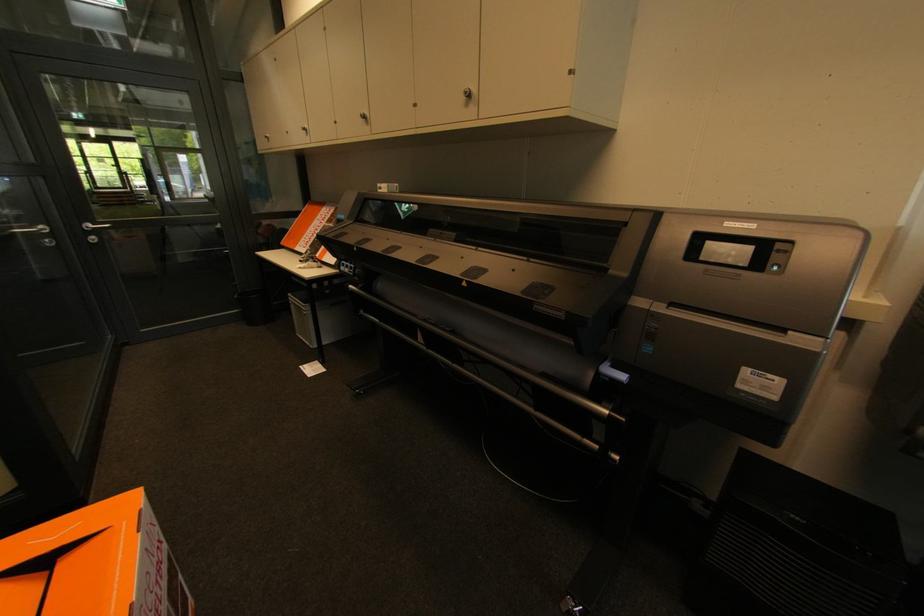
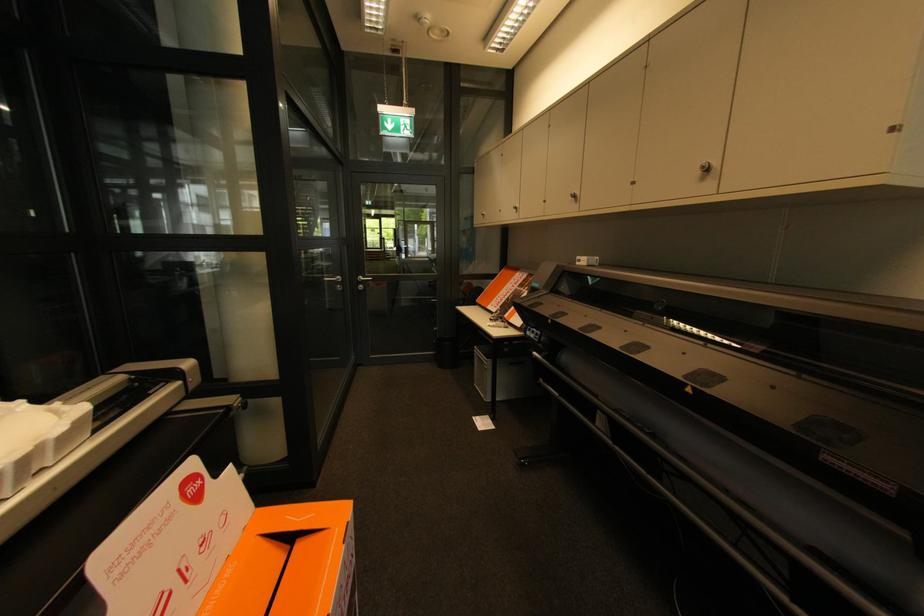
Locate, in the second image, the point that corresponds to pixel 70 562 in the first image.

(304, 546)